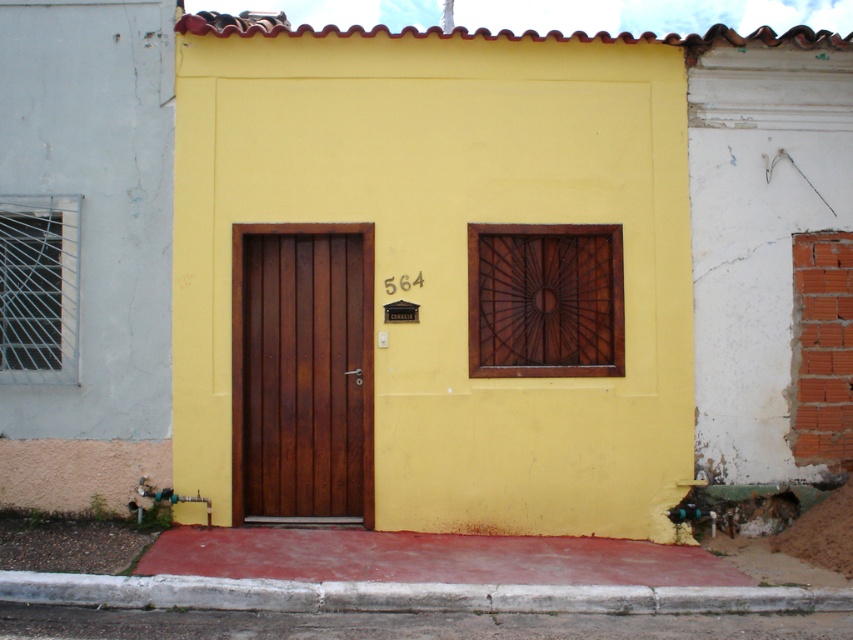
Question: Does wooden door at center have a greater width compared to concrete at lower center?

Choices:
 (A) yes
 (B) no

Answer: (B)

Question: Which of the following is the farthest from the observer?

Choices:
 (A) wooden door at center
 (B) concrete at lower center

Answer: (A)

Question: Is wooden door at center smaller than concrete at lower center?

Choices:
 (A) no
 (B) yes

Answer: (A)

Question: Can you confirm if wooden door at center is positioned to the right of concrete at lower center?

Choices:
 (A) no
 (B) yes

Answer: (A)